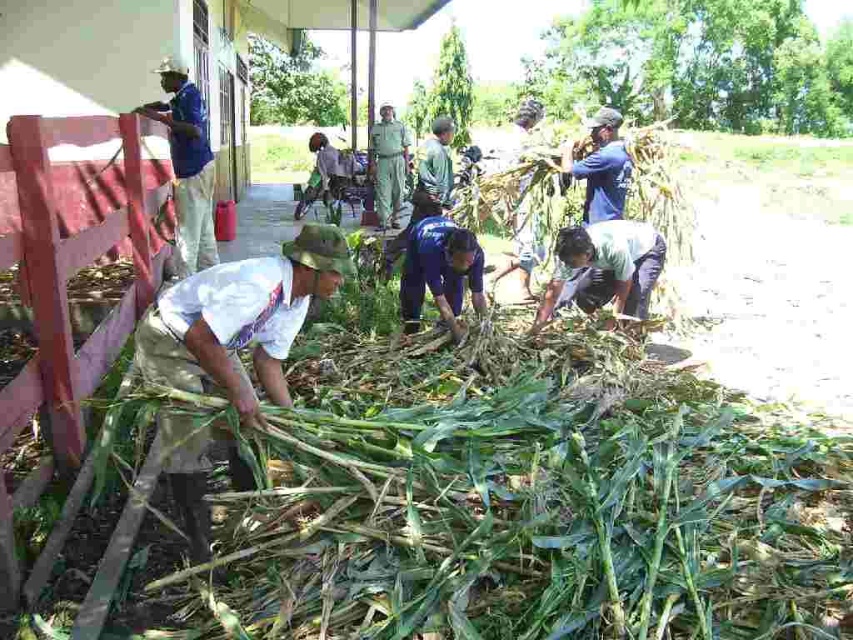
Where is the blue fabric shirt at upper left located in the image?

The blue fabric shirt at upper left is located at point (x=187, y=164) in the image.

You are standing at the edge of the cornfield and need to reach both the blue uniform at center and the green fabric shirt at center. Which one is closer to you?

The blue uniform at center is 2.84 meters away from the green fabric shirt at center, so the distance between them is 2.84 meters. Without knowing your exact position, it is impossible to determine which is closer.

You are standing in the middle of the cornfield and want to walk to the red wooden structure on the left. There are two points marked in the image. Which point, point (643, 266) or point (384, 177), is closer to you as you walk towards the red wooden structure?

Point (643, 266) is closer to the viewer than point (384, 177), so the closer point to you as you walk towards the red wooden structure is point (643, 266).